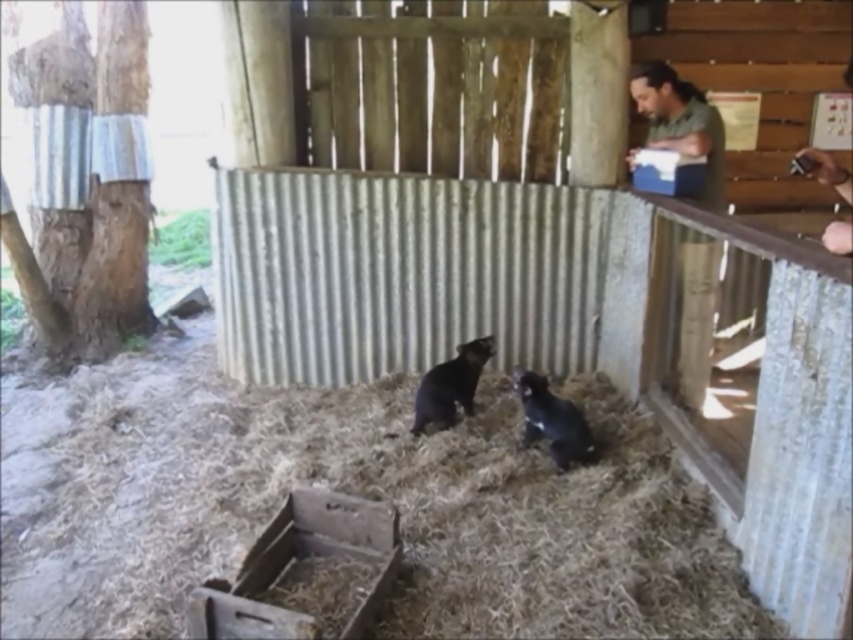
You are a zookeeper observing the enclosure. You need to determine which animal is shorter between the shiny black animal at center and the black furry tasmanian devil at center. Which one is shorter?

The shiny black animal at center is shorter than the black furry tasmanian devil at center according to the description provided.